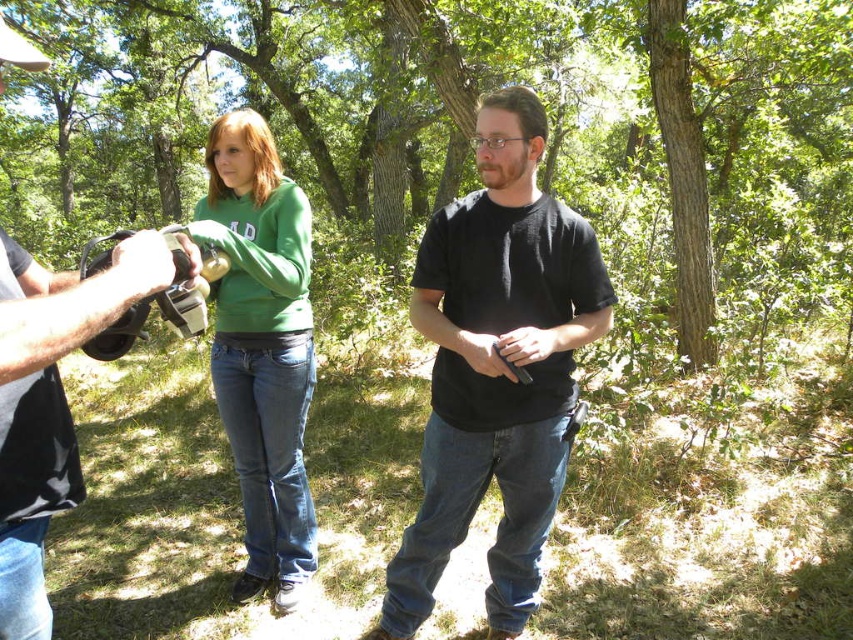
Question: Does brown textured tree at center appear on the left side of green matte hoodie at center?

Choices:
 (A) no
 (B) yes

Answer: (B)

Question: Which point is closer to the camera?

Choices:
 (A) (180, 150)
 (B) (532, 609)

Answer: (B)

Question: Based on their relative distances, which object is farther from the brown textured tree at center?

Choices:
 (A) black cotton shirt at center
 (B) matte black camera at left

Answer: (B)

Question: Which object is farther from the camera taking this photo?

Choices:
 (A) green matte hoodie at center
 (B) matte black camera at left
 (C) black cotton shirt at center

Answer: (A)

Question: Does brown textured tree at center appear on the right side of matte black camera at left?

Choices:
 (A) yes
 (B) no

Answer: (B)

Question: Is brown textured tree at center bigger than green matte hoodie at center?

Choices:
 (A) yes
 (B) no

Answer: (A)